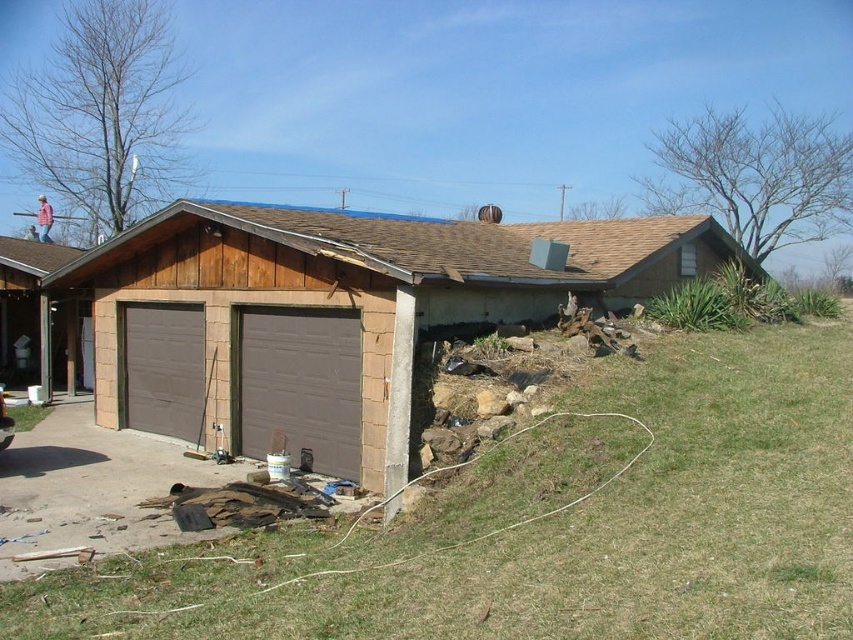
You are a contractor assessing the garage. You notice the brown wood shed at center and the brown matte garage door at center. Which object is located above the other?

The brown wood shed at center is positioned over the brown matte garage door at center, meaning it is above it.

You are a delivery person trying to park a truck that is 2 meters wide. You see the brown concrete driveway at lower left and the brown matte garage door at center. Which location can accommodate your truck based on their widths?

The brown matte garage door at center has a greater width than the brown concrete driveway at lower left. Since the truck is 2 meters wide, the brown matte garage door at center is wider and can accommodate the truck, while the driveway may be too narrow.

You are a delivery person with a cart that is 8 feet wide. You need to move from the brown concrete driveway at lower left to the brown matte garage door at center. Can your cart fit through the space between them?

The distance between the brown concrete driveway at lower left and the brown matte garage door at center is 7.91 feet. Since the cart is 8 feet wide, it cannot fit through the space as it is slightly narrower than the cart.